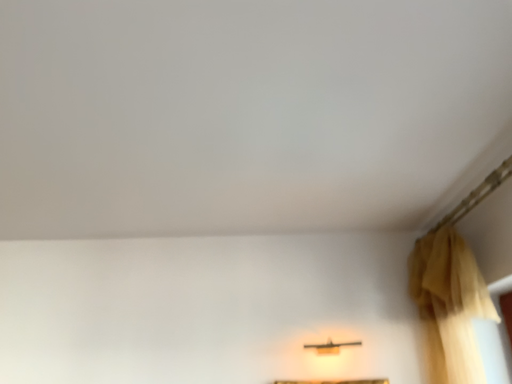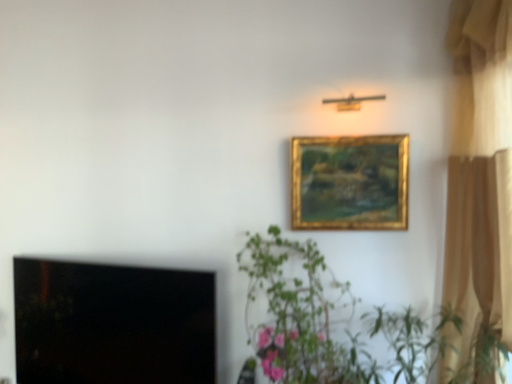
Question: Which way did the camera rotate in the video?

Choices:
 (A) rotated downward
 (B) rotated upward

Answer: (A)